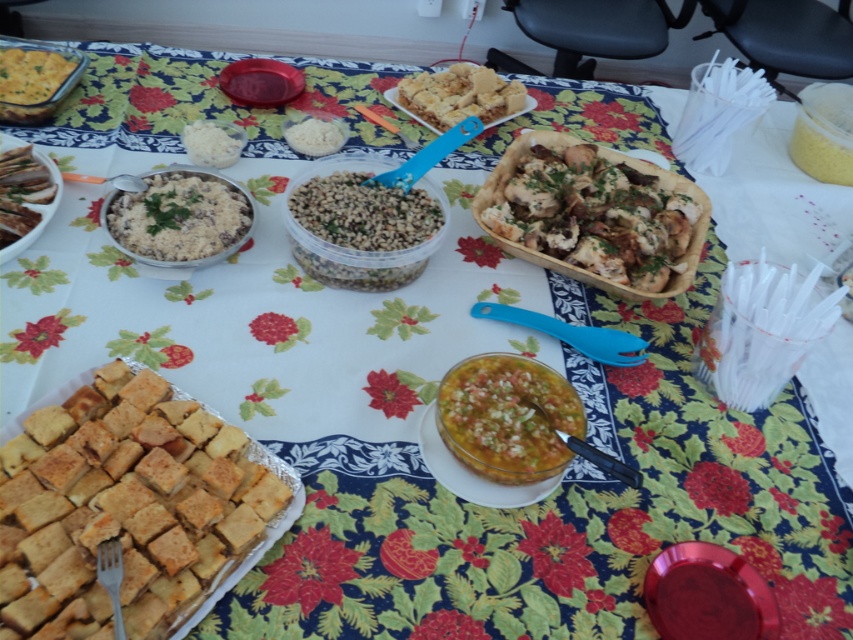
Question: Which point is closer to the camera?

Choices:
 (A) (194, 212)
 (B) (598, 220)
 (C) (235, 506)
 (D) (699, 614)

Answer: (C)

Question: Does white rice at center appear on the right side of white powder at center?

Choices:
 (A) yes
 (B) no

Answer: (B)

Question: Among these objects, which one is nearest to the camera?

Choices:
 (A) white crumbly bread at center
 (B) matte yellow cake at upper left
 (C) white rice at center

Answer: (C)

Question: Does golden brown bread at center appear under shiny red platter at center?

Choices:
 (A) yes
 (B) no

Answer: (B)

Question: Can you confirm if golden brown crumbly bread at center is positioned to the right of matte yellow cake at upper left?

Choices:
 (A) yes
 (B) no

Answer: (A)

Question: Which of the following is the closest to the observer?

Choices:
 (A) (505, 108)
 (B) (575, 214)
 (C) (204, 131)
 (D) (204, 556)

Answer: (D)